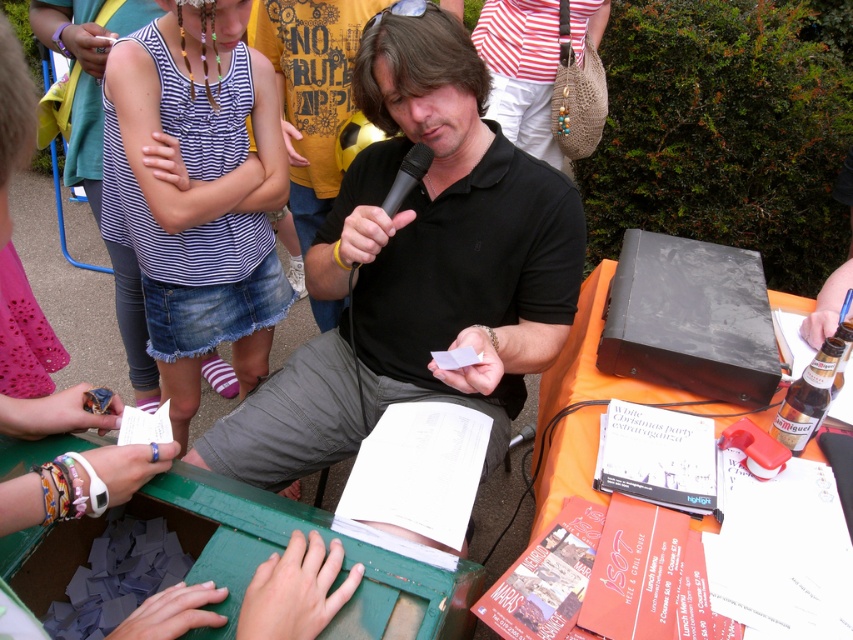
Question: Is green painted wood at lower center further to camera compared to brown glass bottle at lower right?

Choices:
 (A) no
 (B) yes

Answer: (A)

Question: Is green painted wood at lower center to the right of black matte microphone at center from the viewer's perspective?

Choices:
 (A) yes
 (B) no

Answer: (B)

Question: Does green painted wood at lower center have a greater width compared to orange fabric table at right?

Choices:
 (A) yes
 (B) no

Answer: (A)

Question: Which of these objects is positioned closest to the orange fabric table at right?

Choices:
 (A) black matte microphone at center
 (B) black matte shirt at center
 (C) green painted wood at lower center
 (D) brown glass bottle at lower right

Answer: (B)

Question: Which of these objects is positioned closest to the orange fabric table at right?

Choices:
 (A) green painted wood at lower center
 (B) brown glass bottle at lower right

Answer: (B)

Question: Which of the following is the closest to the observer?

Choices:
 (A) (496, 307)
 (B) (397, 177)

Answer: (B)